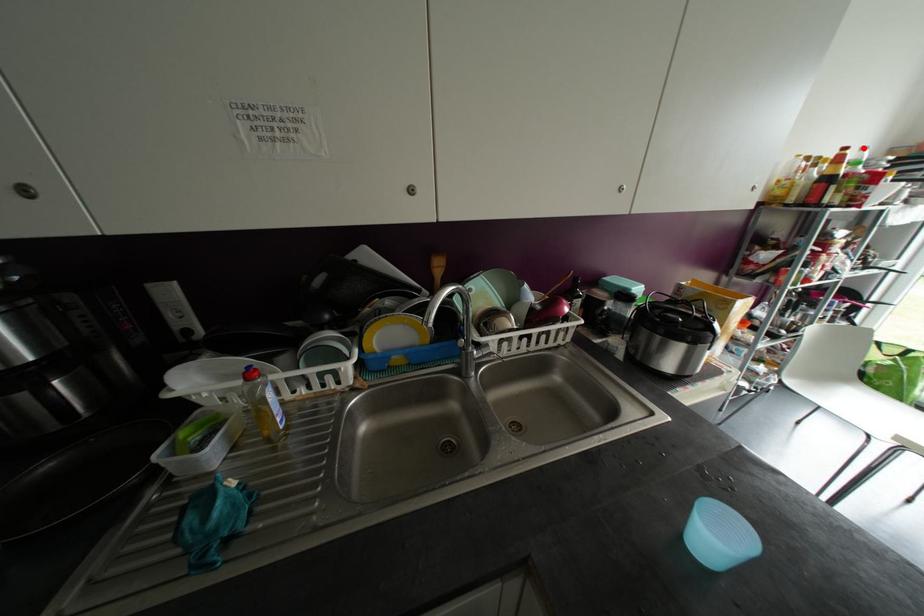
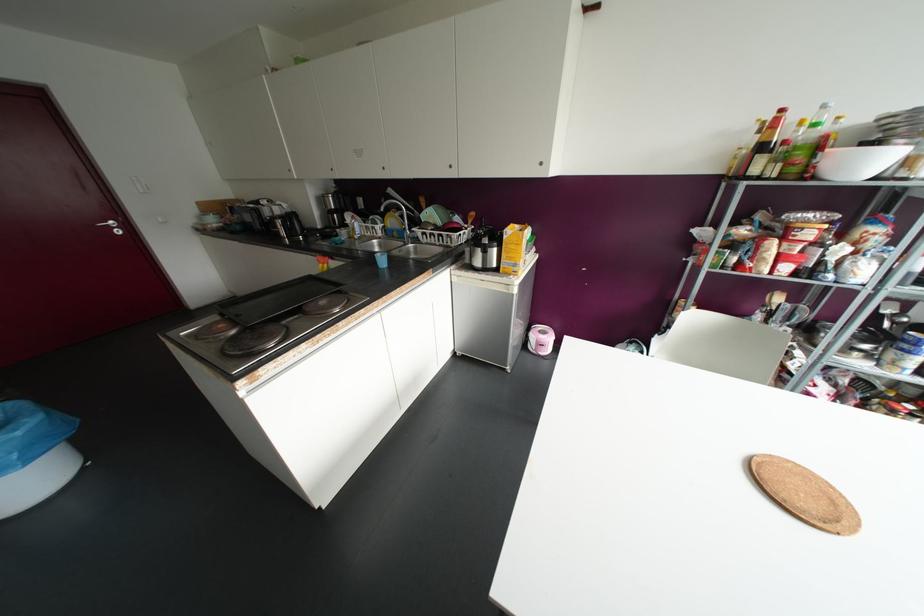
Where in the second image is the point corresponding to the highlighted location from the first image?

(823, 106)